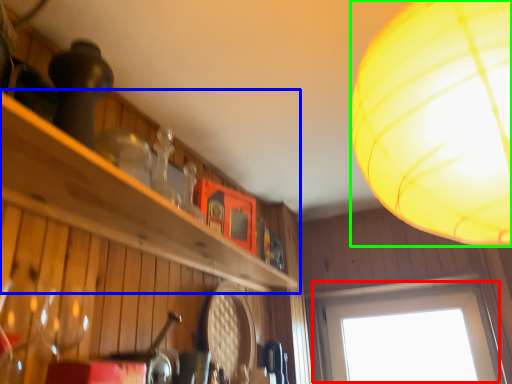
Question: Based on their relative distances, which object is nearer to window (highlighted by a red box)? Choose from shelf (highlighted by a blue box) and lamp (highlighted by a green box).

Choices:
 (A) shelf
 (B) lamp

Answer: (A)